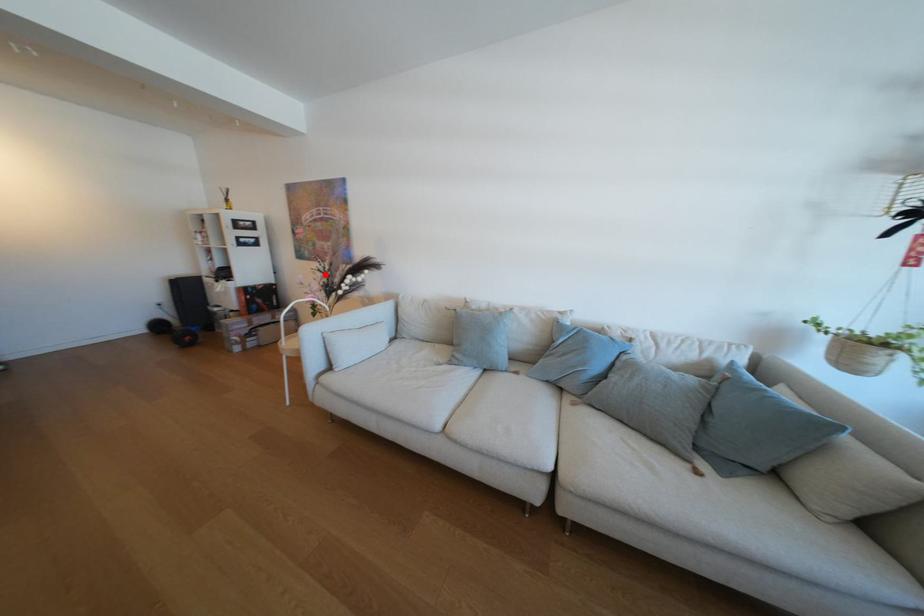
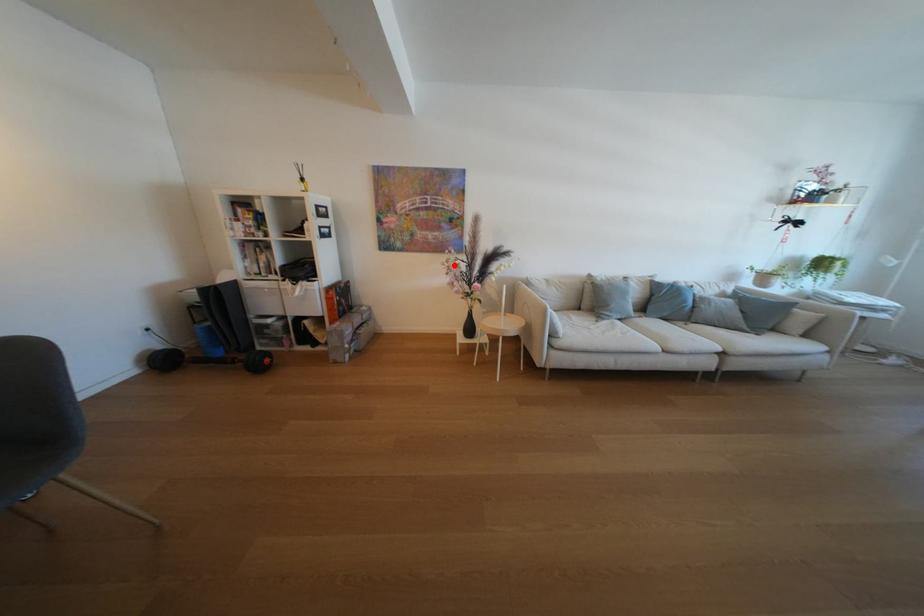
I am providing you with two images of the same scene from different viewpoints. A red point is marked on the first image and another point is marked on the second image. Is the marked point in image1 the same physical position as the marked point in image2?

Yes